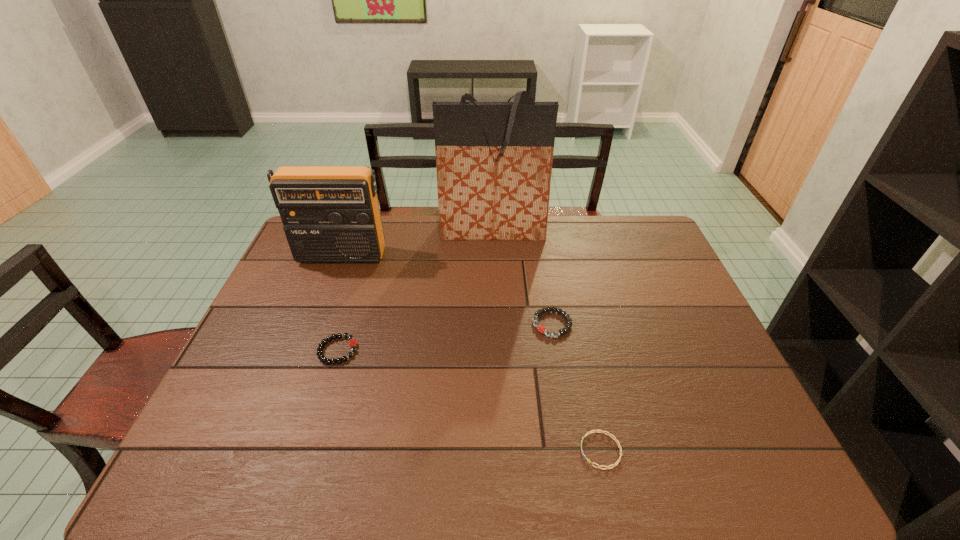
Where is `shopping bag`? The image size is (960, 540). shopping bag is located at coordinates coord(494,160).

Locate an element on the screen. radio receiver is located at coordinates (330, 214).

What are the coordinates of `the leftmost bracelet` in the screenshot? It's located at (353, 343).

Where is `the shortest object`? the shortest object is located at coordinates (613, 465).

Where is `the shortest bracelet`? the shortest bracelet is located at coordinates (613, 465).

This screenshot has width=960, height=540. Identify the location of blank space located on the front-facing side of the tallest object. (495, 301).

Identify the location of vacant area situated on the front-facing side of the second tallest object. tap(306, 348).

The height and width of the screenshot is (540, 960). What are the coordinates of `vacant region located on the right of the leftmost bracelet` in the screenshot? It's located at (395, 350).

Where is `free spot located on the surface of the nearest bracelet showing star-shaped elements`? The width and height of the screenshot is (960, 540). free spot located on the surface of the nearest bracelet showing star-shaped elements is located at coordinates (500, 450).

The width and height of the screenshot is (960, 540). I want to click on vacant space situated 0.210m on the surface of the nearest bracelet showing star-shaped elements, so click(x=487, y=450).